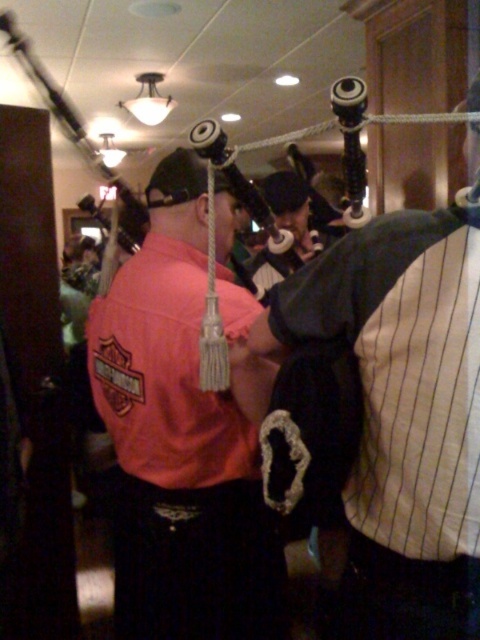
Which of these two, pink fabric shirt at center or black matte bagpipes at center, stands shorter?

black matte bagpipes at center

Does pink fabric shirt at center have a greater width compared to black matte bagpipes at center?

Indeed, pink fabric shirt at center has a greater width compared to black matte bagpipes at center.

Between point (180, 390) and point (410, 424), which one is positioned in front?

Point (410, 424) is in front.

Identify the location of pink fabric shirt at center. (181, 440).